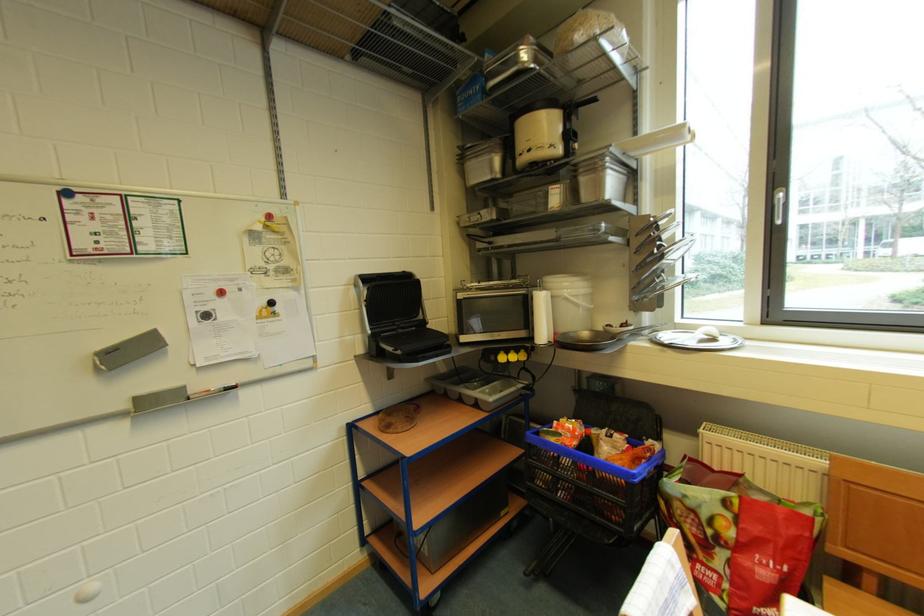
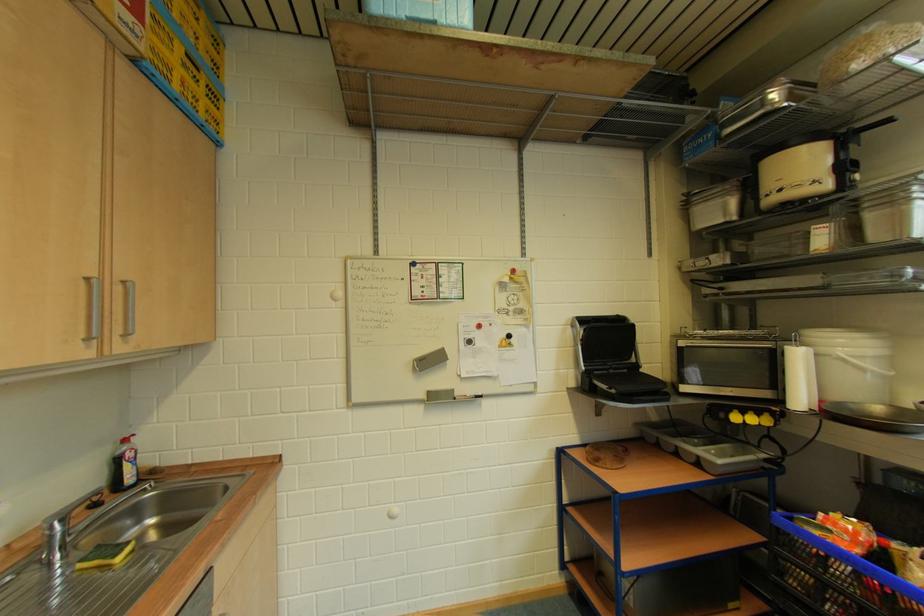
Find the pixel in the second image that matches (548,488) in the first image.

(803, 591)